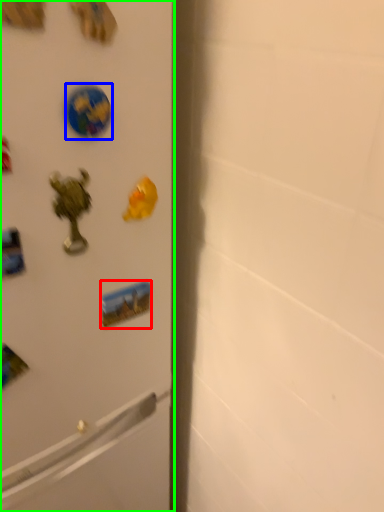
Question: Based on their relative distances, which object is farther from sticker (highlighted by a red box)? Choose from sticker (highlighted by a blue box) and refrigerator (highlighted by a green box).

Choices:
 (A) sticker
 (B) refrigerator

Answer: (A)